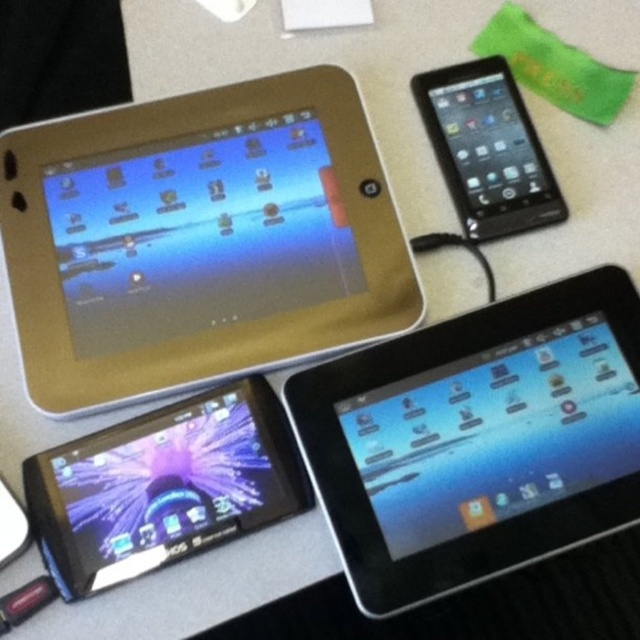
Question: Which of the following is the closest to the observer?

Choices:
 (A) black glossy tablet at center
 (B) black glossy ipod at upper right
 (C) gold matte tablet at upper left
 (D) shiny black tablet at bottom left

Answer: (A)

Question: Considering the relative positions of black glossy tablet at center and shiny black tablet at bottom left in the image provided, where is black glossy tablet at center located with respect to shiny black tablet at bottom left?

Choices:
 (A) left
 (B) right

Answer: (B)

Question: Can you confirm if gold matte tablet at upper left is thinner than black glossy ipod at upper right?

Choices:
 (A) no
 (B) yes

Answer: (A)

Question: Estimate the real-world distances between objects in this image. Which object is farther from the black glossy tablet at center?

Choices:
 (A) gold matte tablet at upper left
 (B) black glossy ipod at upper right
 (C) shiny black tablet at bottom left

Answer: (B)

Question: Does gold matte tablet at upper left have a larger size compared to black glossy ipod at upper right?

Choices:
 (A) no
 (B) yes

Answer: (B)

Question: Among these points, which one is nearest to the camera?

Choices:
 (A) (257, 209)
 (B) (429, 70)

Answer: (A)